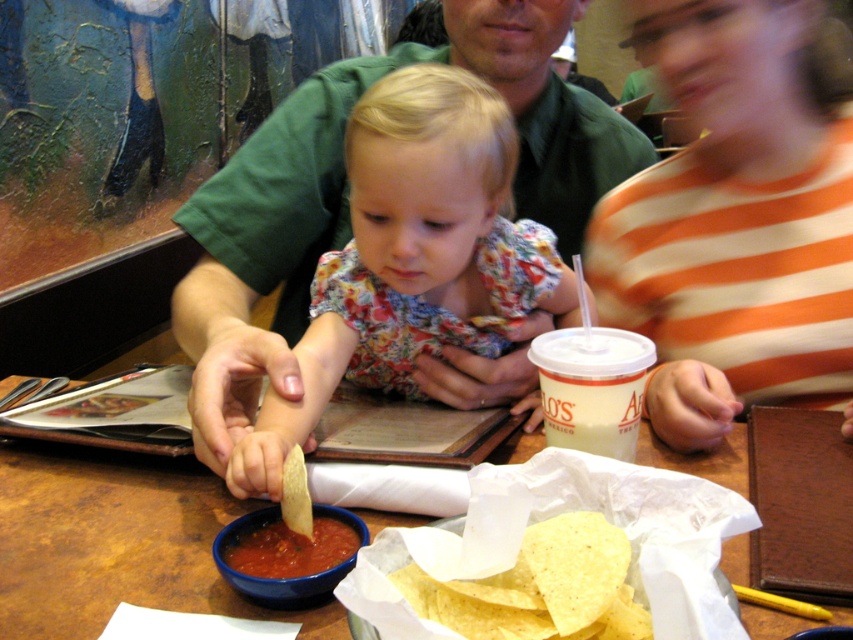
Question: Which point appears closest to the camera in this image?

Choices:
 (A) (326, 547)
 (B) (158, 528)

Answer: (A)

Question: Which point is closer to the camera taking this photo?

Choices:
 (A) (610, 614)
 (B) (310, 554)

Answer: (A)

Question: Is green shirt at center to the left of wooden table at center from the viewer's perspective?

Choices:
 (A) no
 (B) yes

Answer: (A)

Question: Can you confirm if green shirt at center is wider than tomato red paste at center?

Choices:
 (A) no
 (B) yes

Answer: (B)

Question: Is green shirt at center wider than wooden table at center?

Choices:
 (A) yes
 (B) no

Answer: (B)

Question: Which object is farther from the camera taking this photo?

Choices:
 (A) tomato red paste at center
 (B) wooden table at center
 (C) yellow corn tortilla chips at center

Answer: (A)